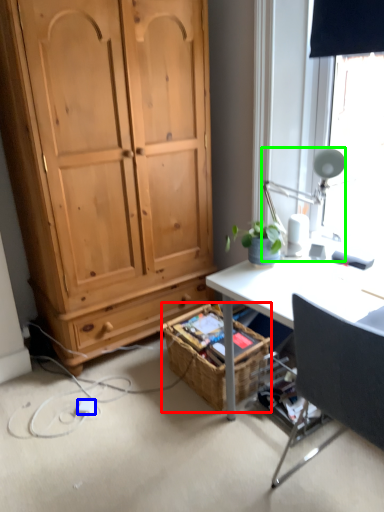
Question: Based on their relative distances, which object is nearer to picnic basket (highlighted by a red box)? Choose from power outlet (highlighted by a blue box) and lamp (highlighted by a green box).

Choices:
 (A) power outlet
 (B) lamp

Answer: (A)